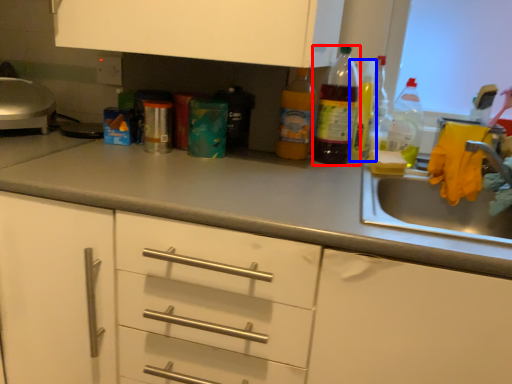
Question: Which of the following is the closest to the observer, bottle (highlighted by a red box) or bottle (highlighted by a blue box)?

Choices:
 (A) bottle
 (B) bottle

Answer: (A)